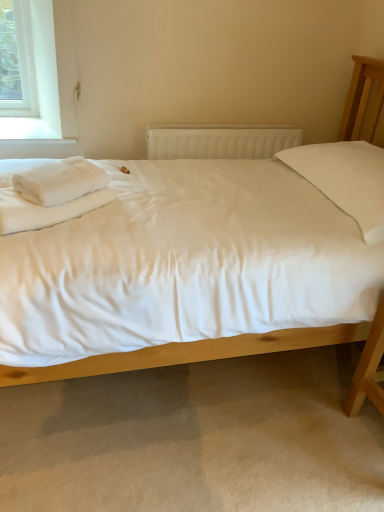
The width and height of the screenshot is (384, 512). Describe the element at coordinates (219, 141) in the screenshot. I see `white plastic radiator at center` at that location.

What do you see at coordinates (234, 356) in the screenshot?
I see `white cotton bed at center` at bounding box center [234, 356].

I want to click on white fluffy towel at left, so click(60, 181).

Which is more to the right, white plastic radiator at center or white fluffy towel at left?

white plastic radiator at center.

Considering the sizes of white plastic radiator at center and white fluffy towel at left in the image, is white plastic radiator at center bigger or smaller than white fluffy towel at left?

In the image, white plastic radiator at center appears to be larger than white fluffy towel at left.

Could you tell me if white plastic radiator at center is facing white fluffy towel at left?

No, white plastic radiator at center is not aimed at white fluffy towel at left.

From the image's perspective, which one is positioned higher, white plastic radiator at center or white fluffy towel at left?

From the image's view, white plastic radiator at center is above.

In the scene shown: Which point is more distant from viewer, (15, 180) or (6, 375)?

Positioned behind is point (15, 180).

From the image's perspective, relative to white cotton bed at center, is white fluffy towel at left above or below?

white fluffy towel at left is above white cotton bed at center.

Would you say white fluffy towel at left is inside or outside white cotton bed at center?

white fluffy towel at left is located inside white cotton bed at center.

Is white plastic radiator at center to the right of white soft bedsheet at left from the viewer's perspective?

Indeed, white plastic radiator at center is positioned on the right side of white soft bedsheet at left.

How different are the orientations of white plastic radiator at center and white soft bedsheet at left in degrees?

white plastic radiator at center and white soft bedsheet at left are facing 53.8 degrees away from each other.

This screenshot has width=384, height=512. I want to click on sheet above the white plastic radiator at center (from a real-world perspective), so click(x=45, y=210).

Does white plastic radiator at center have a greater height compared to white soft bedsheet at left?

Yes, white plastic radiator at center is taller than white soft bedsheet at left.

Locate an element on the screen. sheet behind the white cotton bed at center is located at coordinates (45, 210).

Can you confirm if white cotton bed at center is shorter than white soft bedsheet at left?

In fact, white cotton bed at center may be taller than white soft bedsheet at left.

Which of these two, white cotton bed at center or white soft bedsheet at left, is bigger?

Bigger between the two is white cotton bed at center.

Is white cotton bed at center positioned with its back to white soft bedsheet at left?

No, white cotton bed at center's orientation is not away from white soft bedsheet at left.

From a real-world perspective, is white fluffy towel at left physically located above or below white plastic radiator at center?

In terms of real-world spatial position, white fluffy towel at left is above white plastic radiator at center.

In the scene shown: Is white fluffy towel at left positioned beyond the bounds of white plastic radiator at center?

Yes, white fluffy towel at left is not within white plastic radiator at center.

Does point (98, 187) appear closer or farther from the camera than point (296, 136)?

Point (98, 187) is closer to the camera than point (296, 136).

Considering the sizes of objects white cotton bed at center and white fluffy towel at left in the image provided, who is smaller, white cotton bed at center or white fluffy towel at left?

Smaller between the two is white fluffy towel at left.

Does white cotton bed at center come in front of white fluffy towel at left?

Yes, the depth of white cotton bed at center is less than that of white fluffy towel at left.

Identify the location of bed on the right of white fluffy towel at left. The image size is (384, 512). (234, 356).

Between white cotton bed at center and white fluffy towel at left, which one has more height?

white cotton bed at center is taller.

Does white fluffy towel at left have a greater width compared to white soft bedsheet at left?

No.

Is there a large distance between white fluffy towel at left and white soft bedsheet at left?

No, there isn't a large distance between white fluffy towel at left and white soft bedsheet at left.

Does white fluffy towel at left turn towards white soft bedsheet at left?

No, white fluffy towel at left is not aimed at white soft bedsheet at left.

Considering the sizes of objects white fluffy towel at left and white soft bedsheet at left in the image provided, who is smaller, white fluffy towel at left or white soft bedsheet at left?

white fluffy towel at left is smaller.

Find the location of a particular element. Image resolution: width=384 pixels, height=512 pixels. radiator that is behind the white fluffy towel at left is located at coordinates (219, 141).

Identify the location of material above the white cotton bed at center (from a real-world perspective). (60, 181).

From the image, which object appears to be farther from white soft bedsheet at left, white fluffy towel at left or white cotton bed at center?

Among the two, white cotton bed at center is located further to white soft bedsheet at left.

When comparing their distances from white cotton bed at center, does white fluffy towel at left or white plastic radiator at center seem further?

Among the two, white plastic radiator at center is located further to white cotton bed at center.

Based on the photo, estimate the real-world distances between objects in this image. Which object is closer to white plastic radiator at center, white cotton bed at center or white fluffy towel at left?

The object closer to white plastic radiator at center is white fluffy towel at left.

Based on their spatial positions, is white soft bedsheet at left or white fluffy towel at left further from white plastic radiator at center?

white soft bedsheet at left lies further to white plastic radiator at center than the other object.

Considering their positions, is white plastic radiator at center positioned closer to white cotton bed at center than white soft bedsheet at left?

white soft bedsheet at left lies closer to white cotton bed at center than the other object.

Estimate the real-world distances between objects in this image. Which object is further from white cotton bed at center, white soft bedsheet at left or white plastic radiator at center?

white plastic radiator at center.

Looking at the image, which one is located further to white soft bedsheet at left, white fluffy towel at left or white plastic radiator at center?

white plastic radiator at center lies further to white soft bedsheet at left than the other object.

Which object lies nearer to the anchor point white cotton bed at center, white fluffy towel at left or white soft bedsheet at left?

white soft bedsheet at left is closer to white cotton bed at center.

Identify the location of material between white cotton bed at center and white plastic radiator at center in the front-back direction. This screenshot has height=512, width=384. (60, 181).

I want to click on material between white soft bedsheet at left and white cotton bed at center from left to right, so click(x=60, y=181).

I want to click on material positioned between white soft bedsheet at left and white plastic radiator at center from near to far, so click(x=60, y=181).

Image resolution: width=384 pixels, height=512 pixels. Find the location of `sheet between white cotton bed at center and white plastic radiator at center from front to back`. sheet between white cotton bed at center and white plastic radiator at center from front to back is located at coordinates coord(45,210).